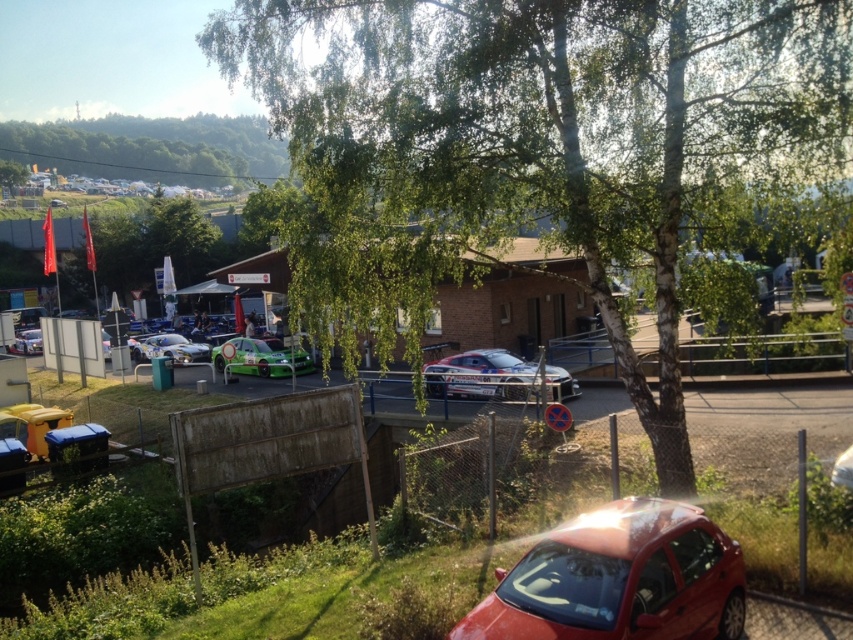
You are a photographer at the motorsport event and want to capture both the green leafy tree at center and the green matte car at center in a single shot. Which object should you focus on first to ensure both are in sharp focus?

You should focus on the green leafy tree at center first because it is closer to the viewer than the green matte car at center, so adjusting focus from near to far will help both objects be in focus.

You are a photographer trying to capture the green leafy tree at upper center in your shot. Given that your camera has a fixed focal length and you can only adjust your position, where should you move relative to the current viewpoint to ensure the tree is centered in your frame?

The green leafy tree at upper center is located at coordinates point (x=155, y=244), so you should move your camera position to align the center of the frame with those coordinates to center the tree.